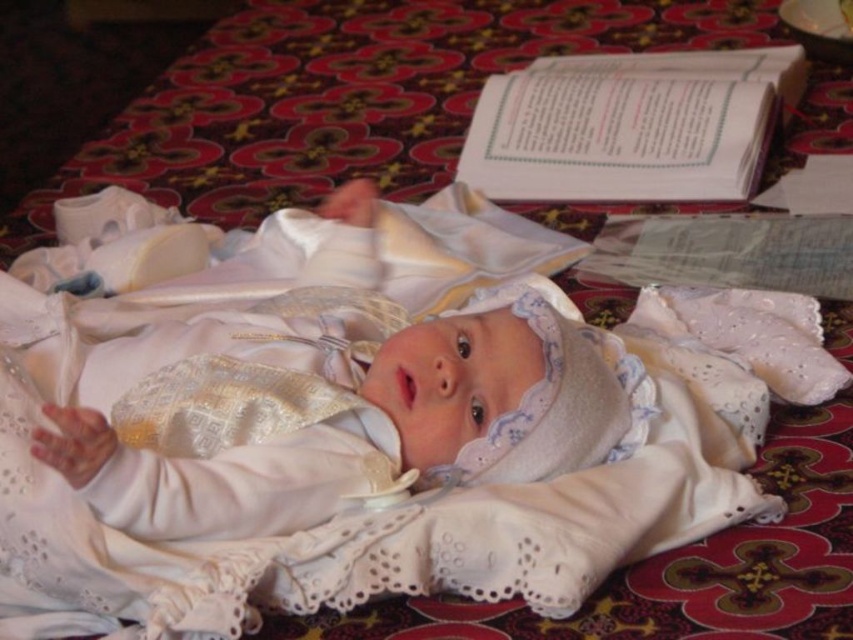
You are a photographer taking a close up shot of the baby in the christening gown. You have two points marked on your viewfinder at coordinates point (273, 348) and point (200, 476). Which point should you focus on to ensure the baby is in sharp focus?

You should focus on point (273, 348) because it is closer to the camera than point (200, 476), ensuring the baby is in sharp focus.

You are a photographer setting up for a photo shoot. You need to place a small prop between the white lace cloth at center and the white satin baby at center. If the prop requires 10 centimeters of space, will there be enough room between them?

The distance between the white lace cloth at center and the white satin baby at center is 11.61 centimeters, which is more than the required 10 centimeters. Therefore, there is enough space to place the prop between them.